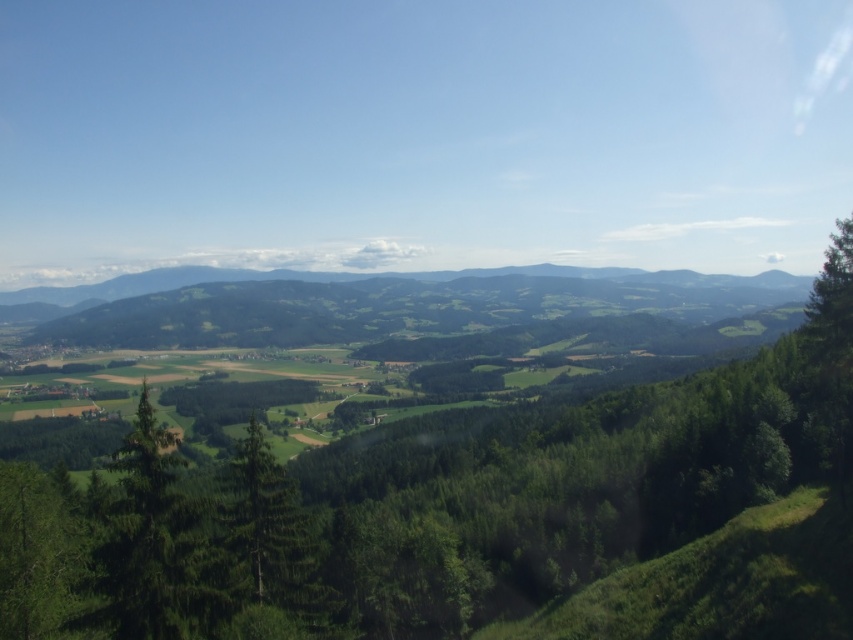
You are standing in the lush green landscape and want to walk towards the two points marked in the image. Which point, point (144, 589) or point (253, 545), will you reach first?

You will reach point (144, 589) first because it is closer to the viewer than point (253, 545).

You are standing in the middle of the forest and see both the green leafy tree at center and the green matte tree at center. Which tree is located to the right of the other?

The green leafy tree at center is positioned on the right side of the green matte tree at center.